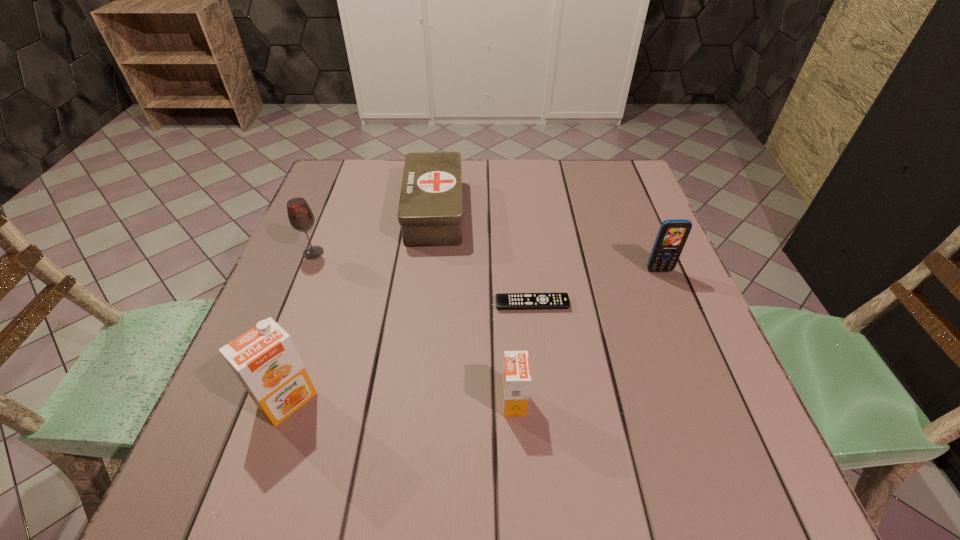
What are the coordinates of `the left orange juice` in the screenshot? It's located at (265, 360).

The width and height of the screenshot is (960, 540). I want to click on the tallest object, so click(265, 360).

Image resolution: width=960 pixels, height=540 pixels. Identify the location of the fourth tallest object. (516, 382).

Find the location of a particular element. The image size is (960, 540). the shorter orange juice is located at coordinates (516, 382).

What are the coordinates of `the second shortest object` in the screenshot? It's located at (430, 212).

Find the location of a particular element. This screenshot has width=960, height=540. the third object from left to right is located at coordinates (430, 212).

Where is `glass drink container`? glass drink container is located at coordinates (301, 218).

This screenshot has height=540, width=960. Find the location of `the fourth farthest object`. the fourth farthest object is located at coordinates (504, 301).

Where is `the shortest object`? The height and width of the screenshot is (540, 960). the shortest object is located at coordinates (504, 301).

I want to click on cellular telephone, so click(x=672, y=235).